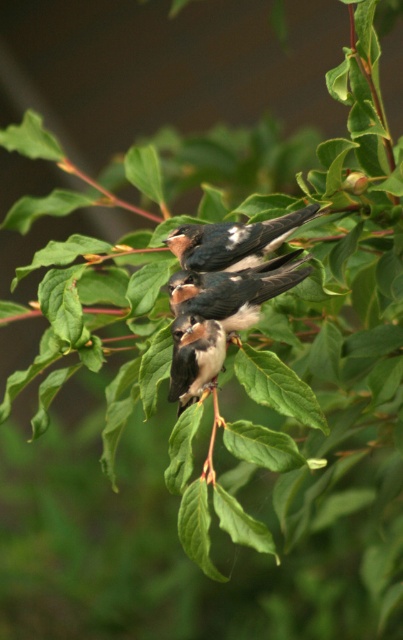
You are a photographer trying to capture a closeup of the birds. You notice two points marked in the image, point A at coordinates point [292,284] and point B at coordinates point [201,348]. Which point is closer to your camera lens?

Point A at coordinates point [292,284] is closer to the camera lens than point B at coordinates point [201,348].

You are a birdwatcher observing the birds on the branch. You notice two objects labeled as speckled feathered swallow at center and brown speckled feathers at center. Which one is positioned more to the right side of the branch?

The speckled feathered swallow at center is positioned more to the right side of the branch compared to the brown speckled feathers at center.

You are a birdwatcher trying to identify two birds in the image. You notice a speckled feathered swallow at center and a brown speckled feathers at center. Which bird has a wider body?

The speckled feathered swallow at center is wider than the brown speckled feathers at center.